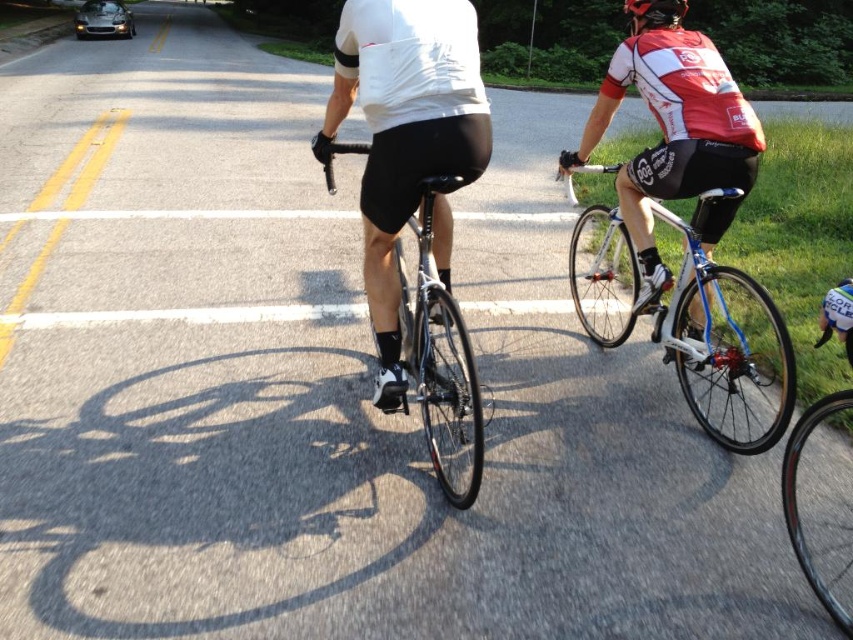
Locate an element on the screen. The image size is (853, 640). shiny black bicycle at center is located at coordinates tap(438, 355).

How distant is shiny black bicycle at center from black matte helmet at upper center?

shiny black bicycle at center is 5.56 feet away from black matte helmet at upper center.

The width and height of the screenshot is (853, 640). I want to click on shiny black bicycle at center, so click(x=438, y=355).

Which is above, white glossy bicycle at center-right or black matte helmet at upper center?

black matte helmet at upper center

Which is behind, point (633, 323) or point (648, 13)?

Point (633, 323)

This screenshot has height=640, width=853. I want to click on white glossy bicycle at center-right, so click(721, 340).

Looking at this image, can you confirm if white glossy bicycle at center-right is taller than shiny black bicycle at center?

Indeed, white glossy bicycle at center-right has a greater height compared to shiny black bicycle at center.

This screenshot has height=640, width=853. Find the location of `white glossy bicycle at center-right`. white glossy bicycle at center-right is located at coordinates (721, 340).

Describe the element at coordinates (721, 340) in the screenshot. I see `white glossy bicycle at center-right` at that location.

The width and height of the screenshot is (853, 640). I want to click on white glossy bicycle at center-right, so click(721, 340).